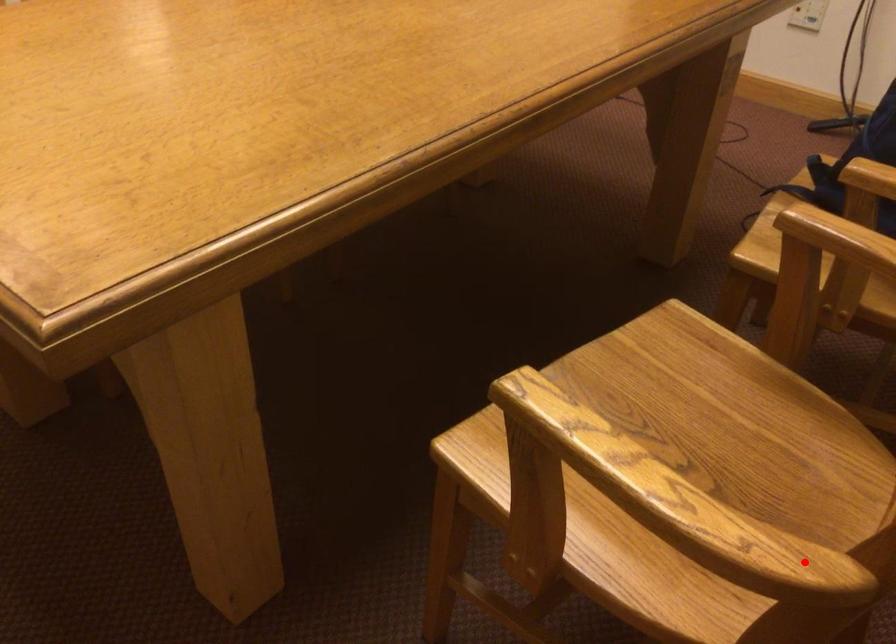
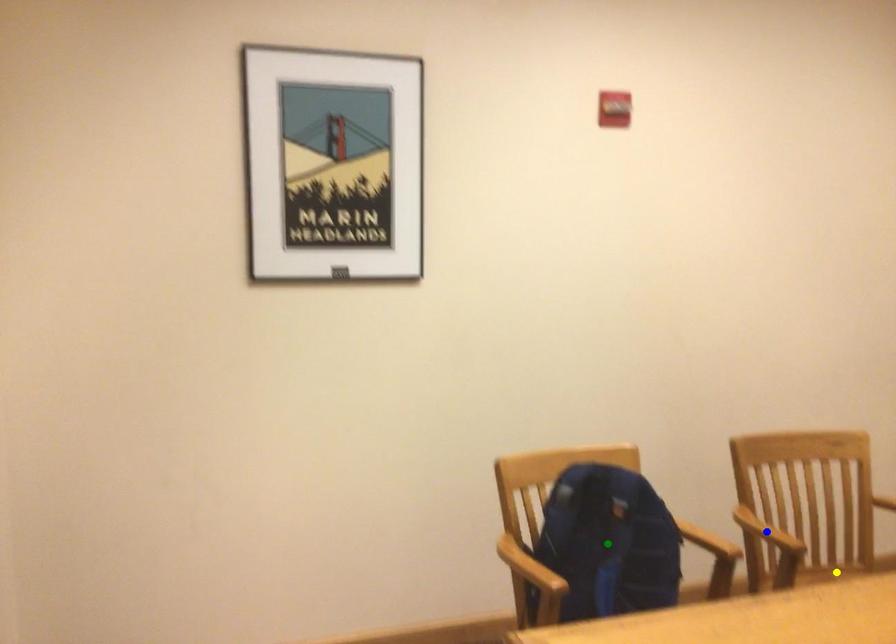
Question: I am providing you with two images of the same scene from different viewpoints. A red point is marked on the first image. You are given multiple points on the second image. Which spot in image 2 lines up with the point in image 1?

Choices:
 (A) yellow point
 (B) blue point
 (C) green point

Answer: (A)